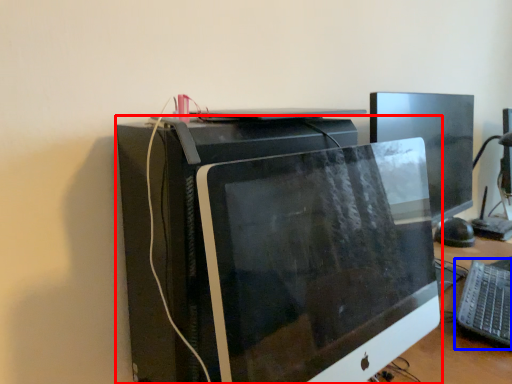
Question: Which object is closer to the camera taking this photo, computer monitor (highlighted by a red box) or computer keyboard (highlighted by a blue box)?

Choices:
 (A) computer monitor
 (B) computer keyboard

Answer: (A)